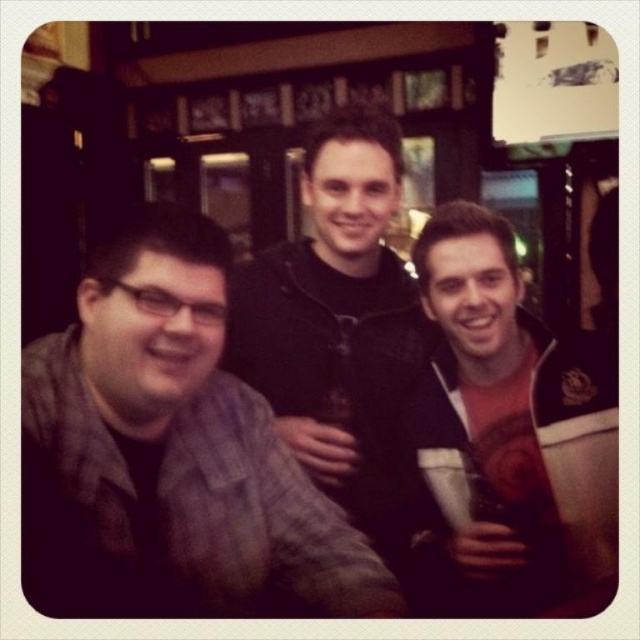
Is plaid fabric shirt at left behind black matte jacket at center?

No, plaid fabric shirt at left is closer to the viewer.

In the scene shown: Which is more to the right, plaid fabric shirt at left or black matte jacket at center?

black matte jacket at center

Is point (68, 550) positioned in front of point (372, 298)?

Yes, it is in front of point (372, 298).

You are a GUI agent. You are given a task and a screenshot of the screen. Output one action in this format:
    pyautogui.click(x=<x>, y=<y>)
    Task: Click on the plaid fabric shirt at left
    
    Given the screenshot: What is the action you would take?
    pyautogui.click(x=170, y=454)

Can you confirm if plaid fabric shirt at left is positioned to the left of white matte cup at center?

Correct, you'll find plaid fabric shirt at left to the left of white matte cup at center.

Can you confirm if plaid fabric shirt at left is positioned below white matte cup at center?

Indeed, plaid fabric shirt at left is positioned under white matte cup at center.

Between point (74, 540) and point (524, 355), which one is positioned in front?

Point (74, 540) is more forward.

Identify the location of plaid fabric shirt at left. (170, 454).

Does white matte cup at center come in front of black matte jacket at center?

Yes, white matte cup at center is in front of black matte jacket at center.

Is white matte cup at center to the right of black matte jacket at center from the viewer's perspective?

Correct, you'll find white matte cup at center to the right of black matte jacket at center.

In the scene shown: Measure the distance between point (492, 230) and camera.

They are 4.23 feet apart.

Find the location of `white matte cup at center`. white matte cup at center is located at coordinates (508, 436).